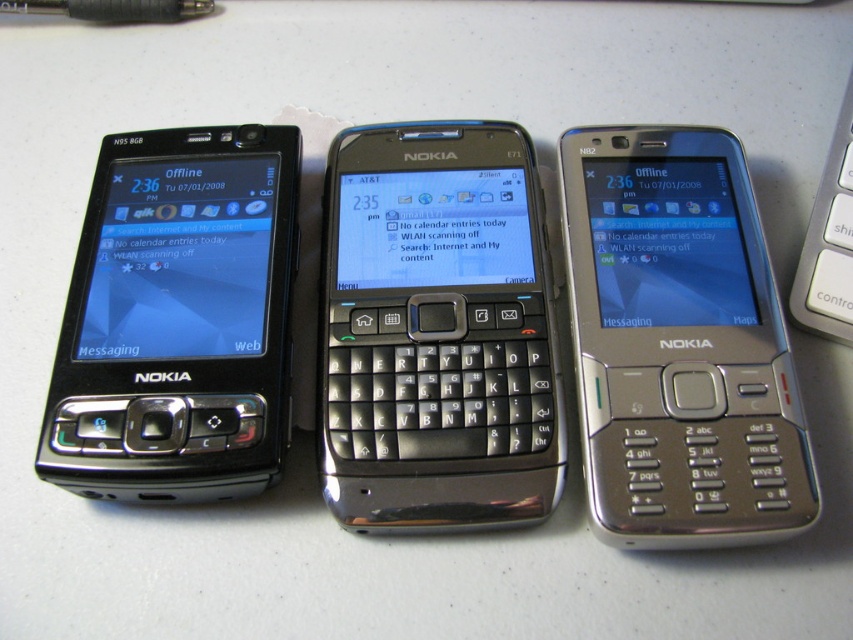
Question: In this image, where is satin black phone at center located relative to black matte nokia phone at left?

Choices:
 (A) right
 (B) left

Answer: (A)

Question: Estimate the real-world distances between objects in this image. Which object is farther from the satin black phone at center?

Choices:
 (A) silver metallic nokia phone at right
 (B) silver metallic keyboard at right
 (C) black matte nokia phone at left

Answer: (B)

Question: Can you confirm if black matte nokia phone at left is smaller than silver metallic keyboard at right?

Choices:
 (A) no
 (B) yes

Answer: (A)

Question: Which point is closer to the camera?

Choices:
 (A) (131, 429)
 (B) (343, 209)
 (C) (593, 372)
 (D) (804, 321)

Answer: (A)

Question: Which of the following is the closest to the observer?

Choices:
 (A) silver metallic nokia phone at right
 (B) satin black phone at center
 (C) black matte nokia phone at left

Answer: (A)

Question: Is satin black phone at center positioned before silver metallic keyboard at right?

Choices:
 (A) no
 (B) yes

Answer: (B)